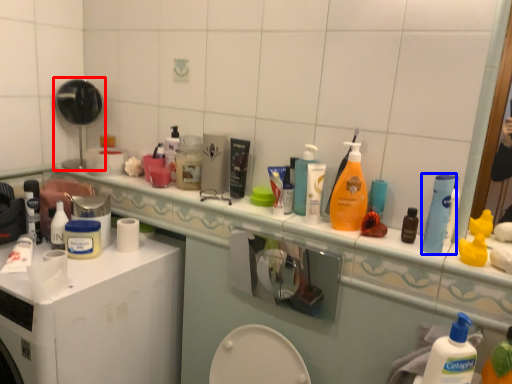
Question: Which of the following is the closest to the observer, mirror (highlighted by a red box) or mouthwash (highlighted by a blue box)?

Choices:
 (A) mirror
 (B) mouthwash

Answer: (B)